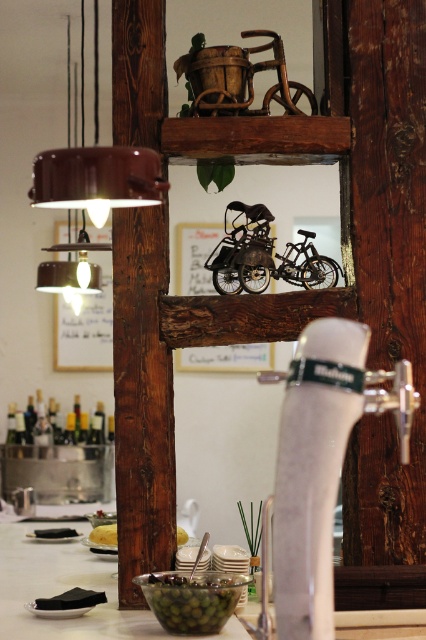
You are standing in front of the wooden structure with the bicycle model. You notice two points marked on the structure. Which point, point (34, 202) or point (95, 596), is closer to your eyes?

Point (34, 202) is closer to the camera than point (95, 596), so it is closer to your eyes.